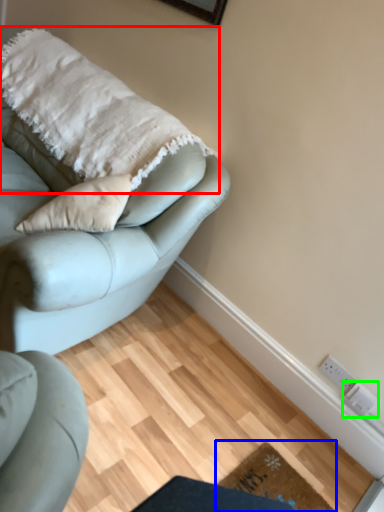
Question: Considering the real-world distances, which object is farthest from blanket (highlighted by a red box)? doormat (highlighted by a blue box) or electric outlet (highlighted by a green box)?

Choices:
 (A) doormat
 (B) electric outlet

Answer: (B)